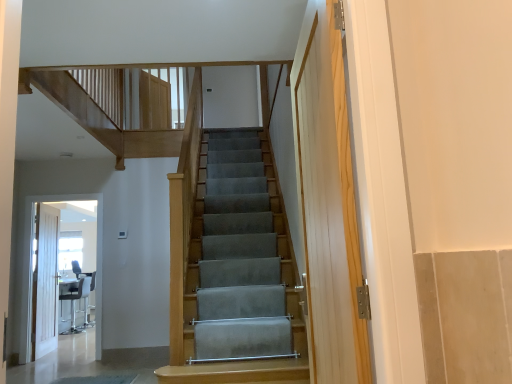
Question: Is matte black chair at lower left oriented away from white painted wooden door at left?

Choices:
 (A) no
 (B) yes

Answer: (A)

Question: Is matte black chair at lower left thinner than white painted wooden door at left?

Choices:
 (A) no
 (B) yes

Answer: (A)

Question: Is matte black chair at lower left wider than white painted wooden door at left?

Choices:
 (A) yes
 (B) no

Answer: (A)

Question: Can you confirm if matte black chair at lower left is taller than white painted wooden door at left?

Choices:
 (A) no
 (B) yes

Answer: (A)

Question: From a real-world perspective, is matte black chair at lower left below white painted wooden door at left?

Choices:
 (A) no
 (B) yes

Answer: (B)

Question: Does matte black chair at lower left touch white painted wooden door at left?

Choices:
 (A) yes
 (B) no

Answer: (B)

Question: Is matte black chair at lower left behind white glossy door at left?

Choices:
 (A) no
 (B) yes

Answer: (B)

Question: Does matte black chair at lower left have a greater height compared to white glossy door at left?

Choices:
 (A) yes
 (B) no

Answer: (B)

Question: From a real-world perspective, is matte black chair at lower left beneath white glossy door at left?

Choices:
 (A) yes
 (B) no

Answer: (A)

Question: Is matte black chair at lower left wider than white glossy door at left?

Choices:
 (A) no
 (B) yes

Answer: (B)

Question: Are matte black chair at lower left and white glossy door at left beside each other?

Choices:
 (A) yes
 (B) no

Answer: (B)

Question: Is matte black chair at lower left not inside white glossy door at left?

Choices:
 (A) yes
 (B) no

Answer: (A)

Question: Can we say white glossy door at left lies outside white painted wooden door at left?

Choices:
 (A) no
 (B) yes

Answer: (B)